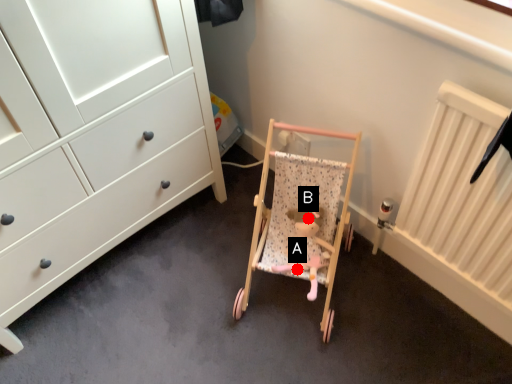
Question: Two points are circled on the image, labeled by A and B beside each circle. Which point is closer to the camera taking this photo?

Choices:
 (A) A is closer
 (B) B is closer

Answer: (B)